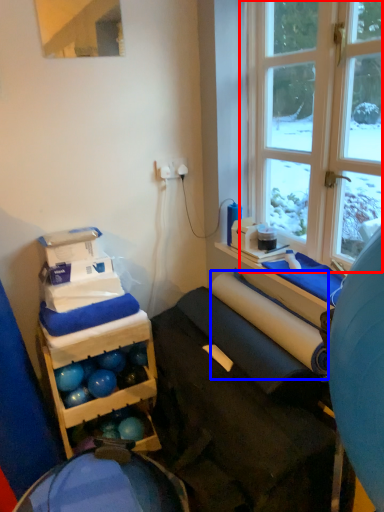
Question: Which object is further to the camera taking this photo, window (highlighted by a red box) or paper towel (highlighted by a blue box)?

Choices:
 (A) window
 (B) paper towel

Answer: (B)